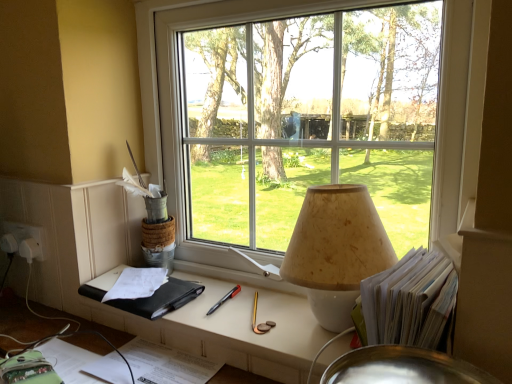
The width and height of the screenshot is (512, 384). Find the location of `vacant space positioned to the left of beige textured lampshade at center`. vacant space positioned to the left of beige textured lampshade at center is located at coordinates coord(245,309).